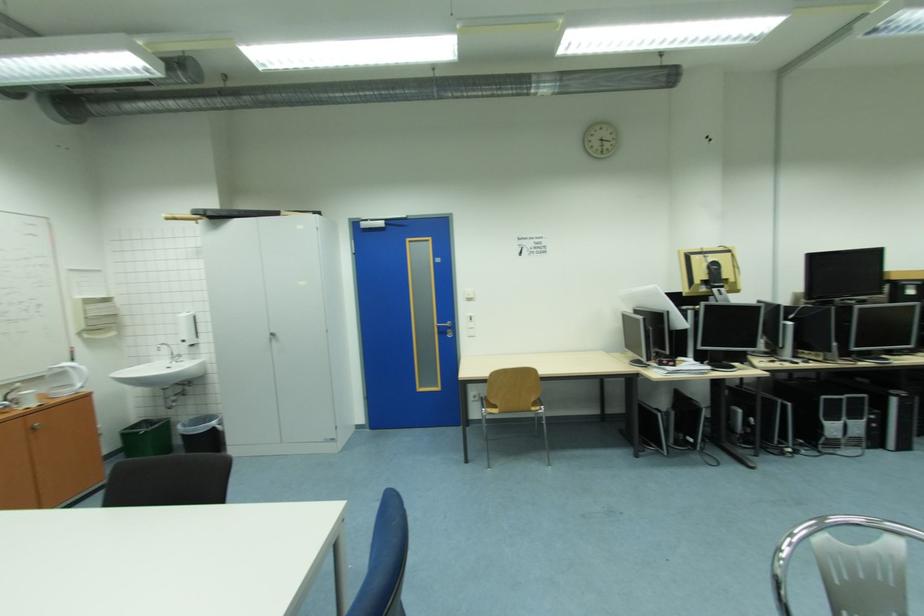
Describe the element at coordinates (35, 426) in the screenshot. I see `a brown cabinet knob` at that location.